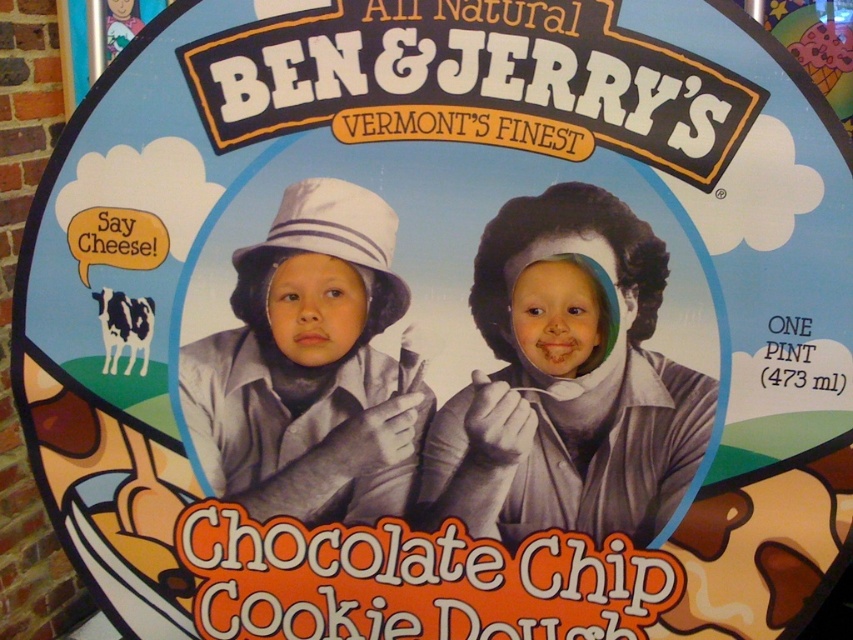
Is smooth chocolate at upper right smaller than white matte hat at center?

No, smooth chocolate at upper right is not smaller than white matte hat at center.

Who is shorter, smooth chocolate at upper right or white matte hat at center?

white matte hat at center

Image resolution: width=853 pixels, height=640 pixels. I want to click on smooth chocolate at upper right, so click(567, 381).

You are a GUI agent. You are given a task and a screenshot of the screen. Output one action in this format:
    pyautogui.click(x=<x>, y=<y>)
    Task: Click on the smooth chocolate at upper right
    The height and width of the screenshot is (640, 853).
    Given the screenshot: What is the action you would take?
    pyautogui.click(x=567, y=381)